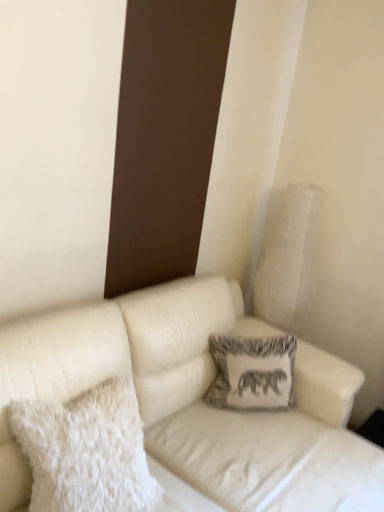
Question: From the image's perspective, is printed fabric pillow at center, placed as the second pillow when sorted from left to right, under white fluffy pillow at left, which is counted as the first pillow, starting from the left?

Choices:
 (A) yes
 (B) no

Answer: (B)

Question: Are printed fabric pillow at center, placed as the second pillow when sorted from left to right, and white fluffy pillow at left, marked as the third pillow in a right-to-left arrangement, making contact?

Choices:
 (A) yes
 (B) no

Answer: (B)

Question: Considering the relative sizes of printed fabric pillow at center, the 2th pillow viewed from the front, and white fluffy pillow at left, marked as the third pillow in a right-to-left arrangement, in the image provided, is printed fabric pillow at center, the 2th pillow viewed from the front, wider than white fluffy pillow at left, marked as the third pillow in a right-to-left arrangement,?

Choices:
 (A) no
 (B) yes

Answer: (A)

Question: Can you confirm if printed fabric pillow at center, placed as the second pillow when sorted from left to right, is taller than white fluffy pillow at left, the first pillow positioned from the front?

Choices:
 (A) no
 (B) yes

Answer: (B)

Question: Is white fluffy pillow at left, the first pillow positioned from the front, located within printed fabric pillow at center, the 2th pillow positioned from the back?

Choices:
 (A) yes
 (B) no

Answer: (B)

Question: Is printed fabric pillow at center, the 2th pillow positioned from the back, oriented towards white fluffy pillow at left, the first pillow positioned from the front?

Choices:
 (A) no
 (B) yes

Answer: (A)

Question: Can you confirm if white textured pillow at upper right, the 3th pillow positioned from the left, is bigger than white leather couch at center?

Choices:
 (A) no
 (B) yes

Answer: (A)

Question: Can you confirm if white textured pillow at upper right, acting as the 3th pillow starting from the front, is shorter than white leather couch at center?

Choices:
 (A) no
 (B) yes

Answer: (A)

Question: Is white textured pillow at upper right, the 1th pillow positioned from the back, at the left side of white leather couch at center?

Choices:
 (A) yes
 (B) no

Answer: (B)

Question: Is white textured pillow at upper right, acting as the 3th pillow starting from the front, completely or partially outside of white leather couch at center?

Choices:
 (A) yes
 (B) no

Answer: (A)

Question: Is white textured pillow at upper right, the 1th pillow positioned from the back, at the right side of white leather couch at center?

Choices:
 (A) yes
 (B) no

Answer: (A)

Question: Is white leather couch at center located within white textured pillow at upper right, the 1th pillow positioned from the back?

Choices:
 (A) no
 (B) yes

Answer: (A)

Question: Is white textured pillow at upper right, the 1th pillow positioned from the back, thinner than white fluffy pillow at left, which is counted as the first pillow, starting from the left?

Choices:
 (A) no
 (B) yes

Answer: (A)